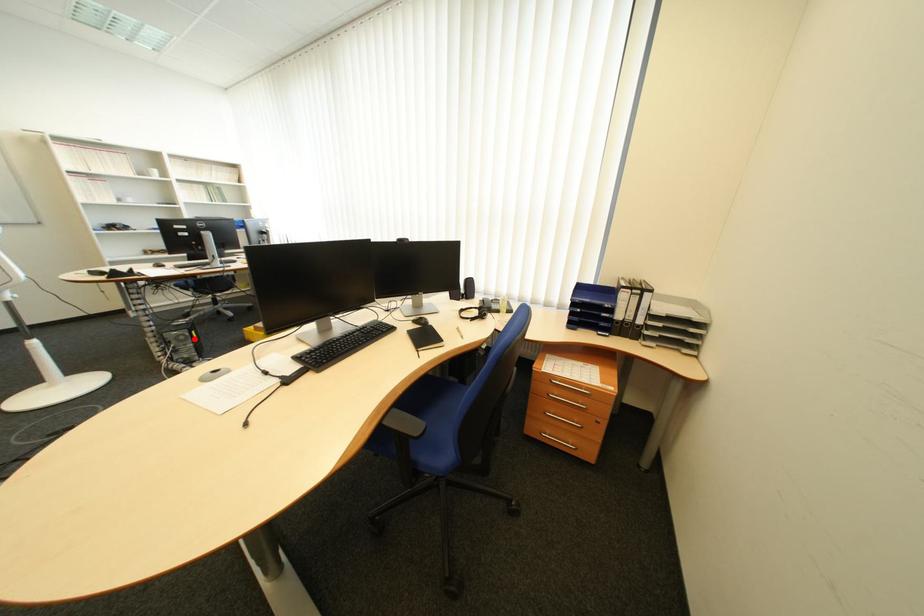
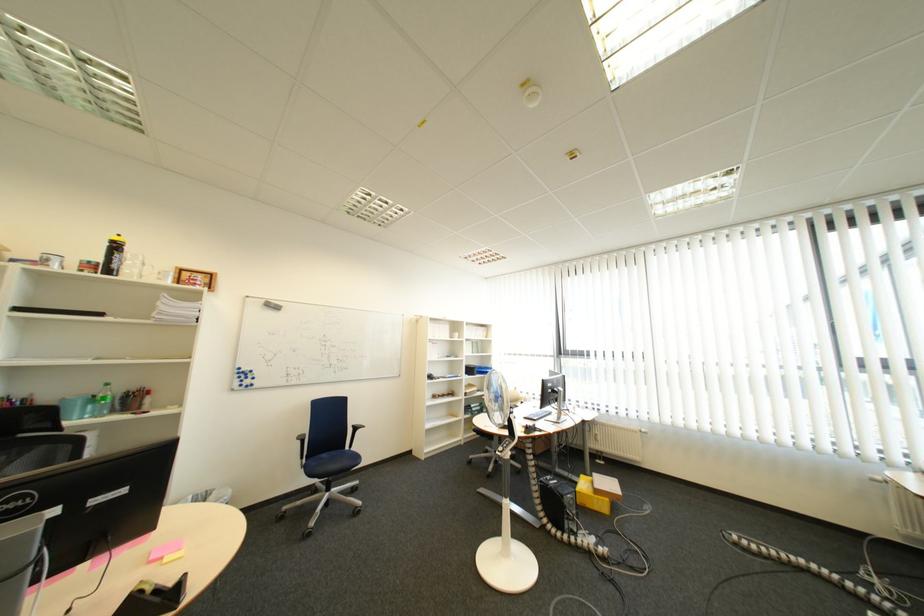
Question: A red point is marked in image1. In image2, is the corresponding 3D point closer to the camera or farther? Reply with the corresponding letter.

Choices:
 (A) The corresponding 3D point is closer.
 (B) The corresponding 3D point is farther.

Answer: (B)